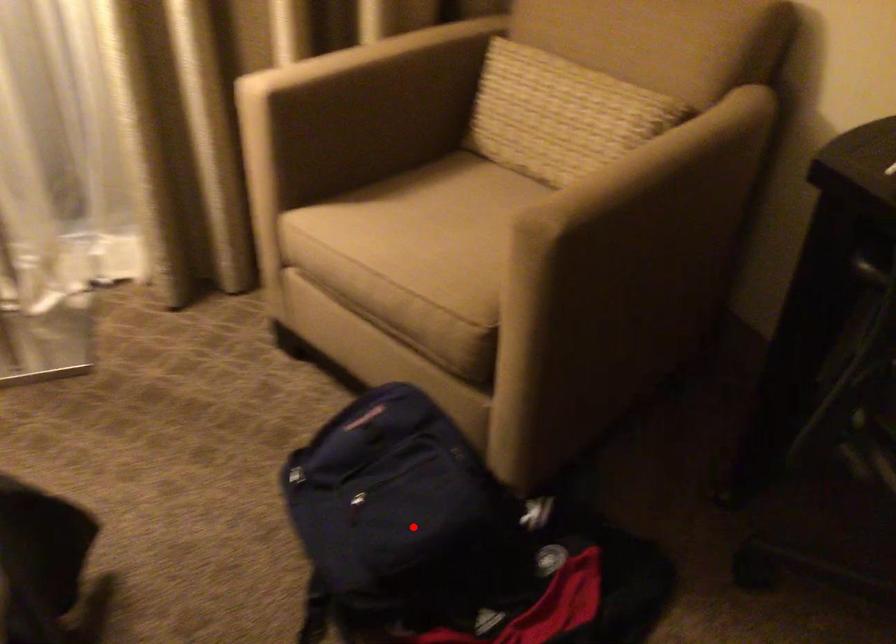
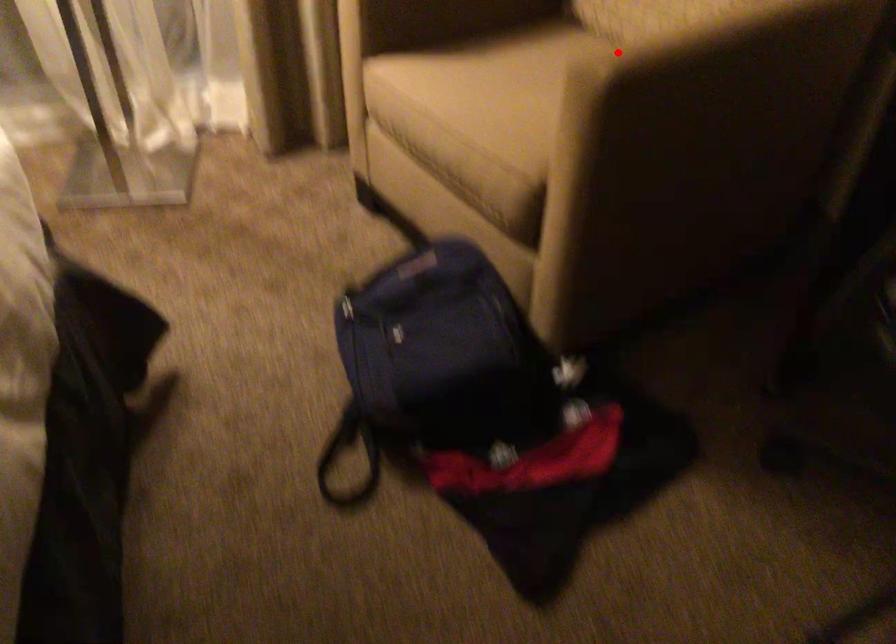
From the picture: I am providing you with two images of the same scene from different viewpoints. A red point is marked on the first image and another point is marked on the second image. Is the marked point in image1 the same physical position as the marked point in image2?

No